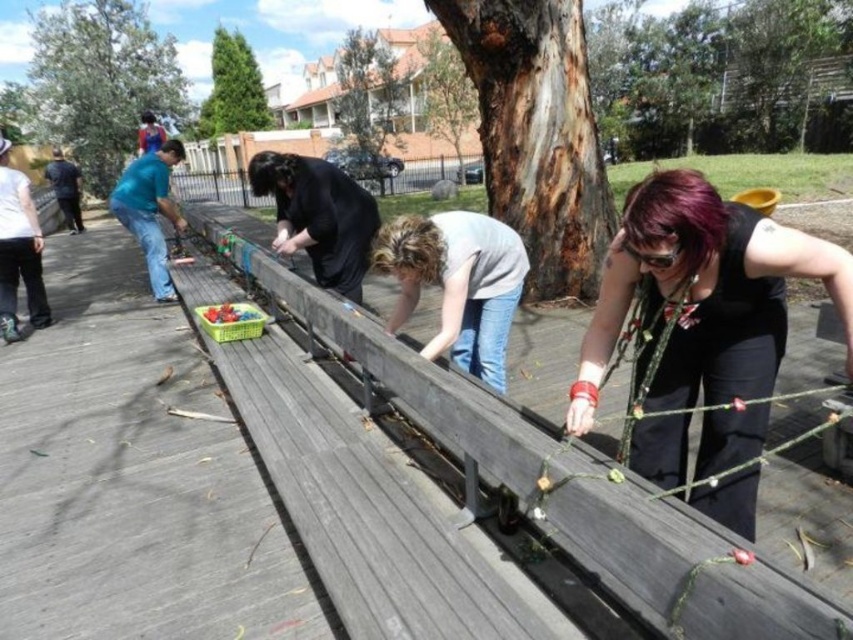
Between black matte shirt at center and white cotton shirt at left, which one has more height?

white cotton shirt at left is taller.

Between black matte shirt at center and white cotton shirt at left, which one is positioned higher?

white cotton shirt at left

Locate an element on the screen. black matte shirt at center is located at coordinates (703, 292).

Is black matte shirt at center thinner than wooden rail at center?

Yes.

Which is above, black matte shirt at center or wooden rail at center?

wooden rail at center is above.

The image size is (853, 640). What do you see at coordinates (703, 292) in the screenshot? I see `black matte shirt at center` at bounding box center [703, 292].

Image resolution: width=853 pixels, height=640 pixels. What are the coordinates of `black matte shirt at center` in the screenshot? It's located at (703, 292).

Does white cotton shirt at left lie in front of jeans at left?

Yes, white cotton shirt at left is in front of jeans at left.

Is white cotton shirt at left further to camera compared to jeans at left?

No, it is in front of jeans at left.

The image size is (853, 640). What do you see at coordinates (18, 250) in the screenshot?
I see `white cotton shirt at left` at bounding box center [18, 250].

Where is `white cotton shirt at left`? The height and width of the screenshot is (640, 853). white cotton shirt at left is located at coordinates (18, 250).